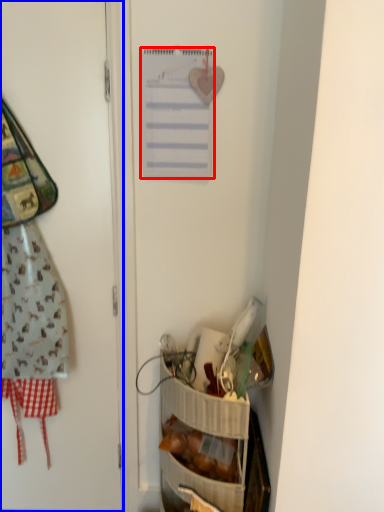
Question: Among these objects, which one is nearest to the camera, list (highlighted by a red box) or door (highlighted by a blue box)?

Choices:
 (A) list
 (B) door

Answer: (B)